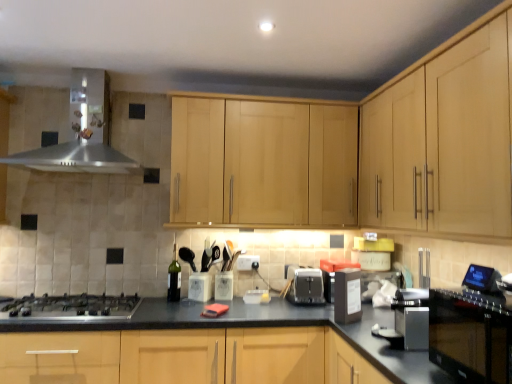
Identify the location of free space above satin silver toaster at center, which is the 1th appliance in left-to-right order (from a real-world perspective). (300, 268).